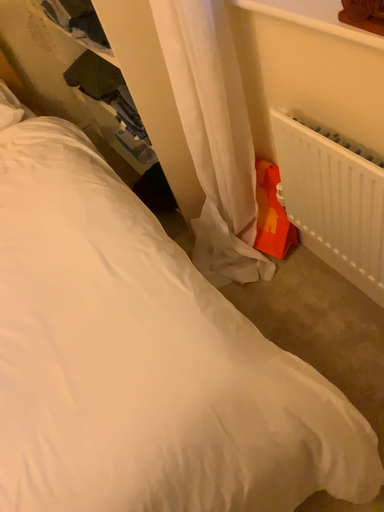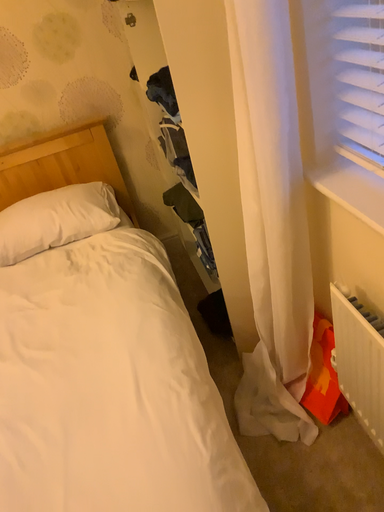
Question: Which way did the camera rotate in the video?

Choices:
 (A) rotated downward
 (B) rotated upward

Answer: (B)